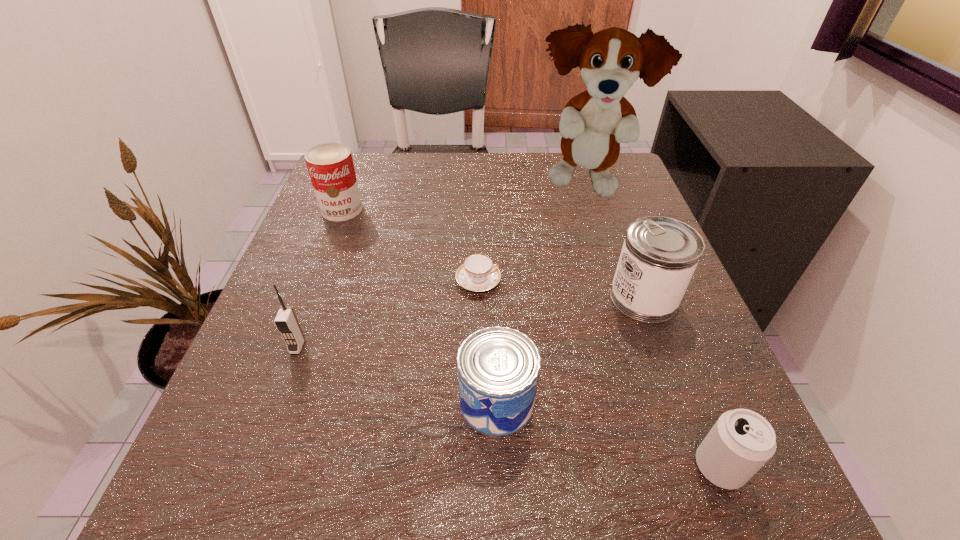
Locate an element on the screen. The image size is (960, 540). vacant region located 0.180m on the left of the second farthest can is located at coordinates (507, 298).

The image size is (960, 540). I want to click on vacant space located on the front-facing side of the cellular telephone, so click(245, 489).

You are a GUI agent. You are given a task and a screenshot of the screen. Output one action in this format:
    pyautogui.click(x=<x>, y=<y>)
    Task: Click on the vacant space located on the front label of the third can from right to left
    The width and height of the screenshot is (960, 540).
    Given the screenshot: What is the action you would take?
    pyautogui.click(x=360, y=402)

Where is `free space located 0.090m on the front label of the third can from right to left`? free space located 0.090m on the front label of the third can from right to left is located at coordinates (396, 402).

Locate an element on the screen. Image resolution: width=960 pixels, height=540 pixels. vacant point located on the front label of the third can from right to left is located at coordinates (225, 402).

This screenshot has width=960, height=540. Find the location of `free space located on the left of the nearest can`. free space located on the left of the nearest can is located at coordinates (x=448, y=467).

Where is `free location located on the side with the handle of the shortest object`? This screenshot has width=960, height=540. free location located on the side with the handle of the shortest object is located at coordinates (679, 281).

What are the coordinates of `puppy present at the far edge` in the screenshot? It's located at (593, 123).

Where is `can situated at the far edge`? can situated at the far edge is located at coordinates (330, 165).

At what (x,y) coordinates should I click in order to perform the action: click on object situated at the near edge. Please return your answer as a coordinate pair (x, y). Looking at the image, I should click on (741, 441).